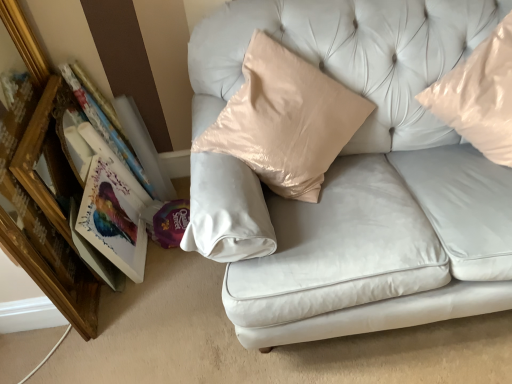
In order to click on free space in front of matte paper book at left in this screenshot , I will do `click(120, 303)`.